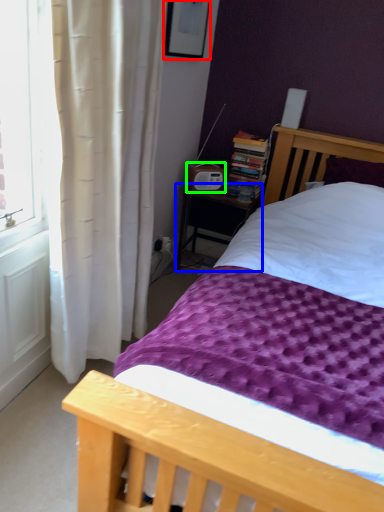
Question: Considering the real-world distances, which object is closest to picture frame (highlighted by a red box)? nightstand (highlighted by a blue box) or radio (highlighted by a green box).

Choices:
 (A) nightstand
 (B) radio

Answer: (B)